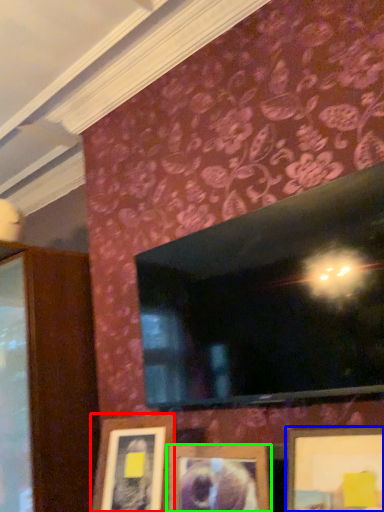
Question: Which object is the farthest from picture frame (highlighted by a red box)? Choose among these: picture frame (highlighted by a blue box) or picture frame (highlighted by a green box).

Choices:
 (A) picture frame
 (B) picture frame

Answer: (A)